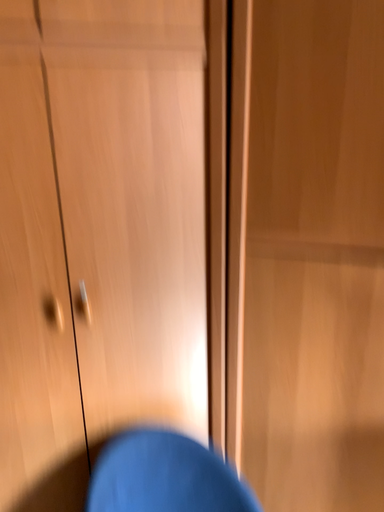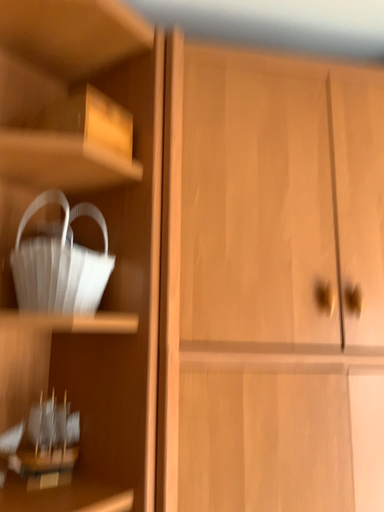
Question: How did the camera likely rotate when shooting the video?

Choices:
 (A) rotated downward
 (B) rotated upward

Answer: (B)